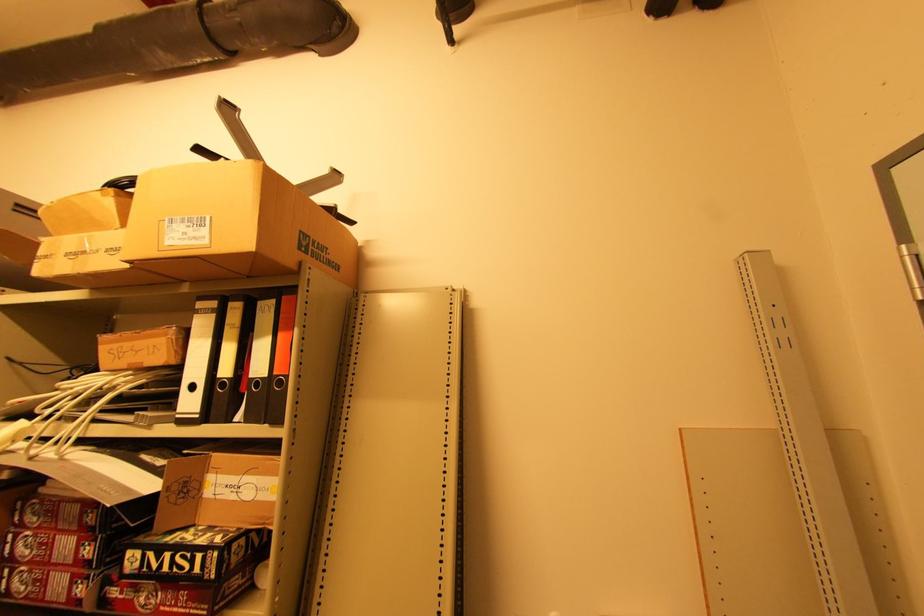
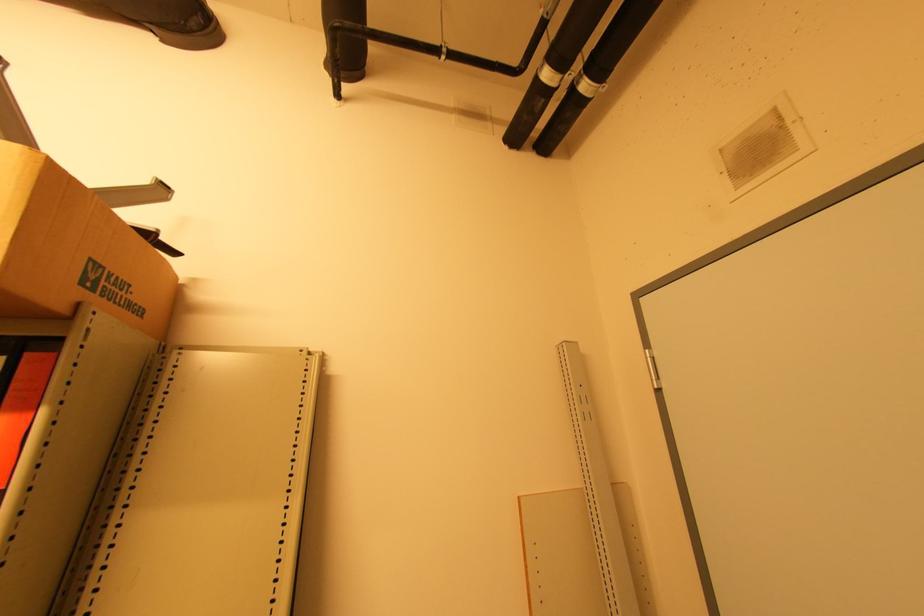
Locate, in the second image, the point that corresponds to point (310, 253) in the first image.

(95, 290)